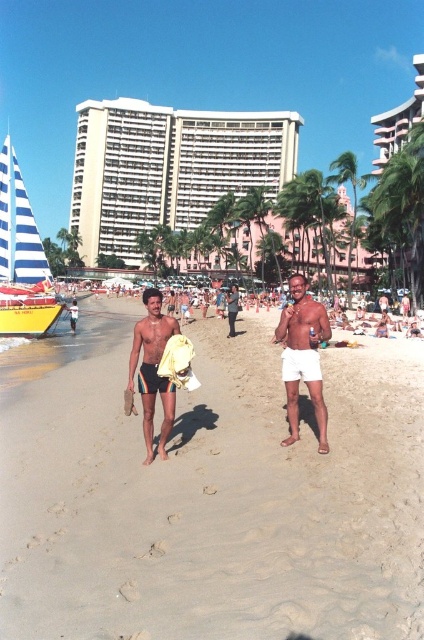
You are standing on the beige sandy beach at center and want to take a photo of the blue striped sailboat at left. In which direction should you move to frame the sailboat in your camera?

You should move to your left because the beige sandy beach at center is to the right of the blue striped sailboat at left, so moving left will bring the sailboat into view.